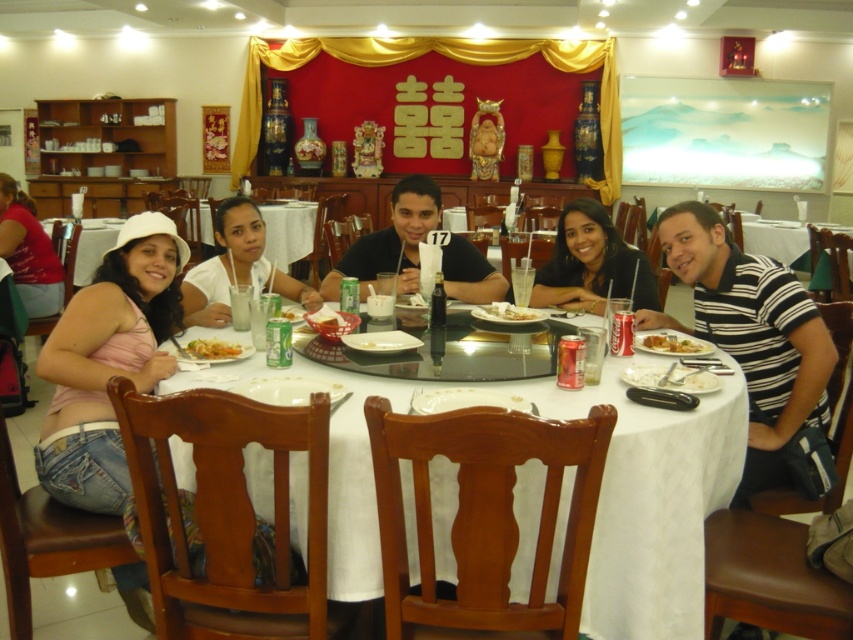
You are a photographer adjusting your camera focus. You need to focus on both the point at coordinates point [169,387] and the point at coordinates point [643,339]. Since they are at different distances from the camera, which point should you focus on first to ensure the closer one is sharp?

Point [169,387] is closer to the camera than point [643,339], so you should focus on point [169,387] first to ensure it is sharp before adjusting for the farther point.